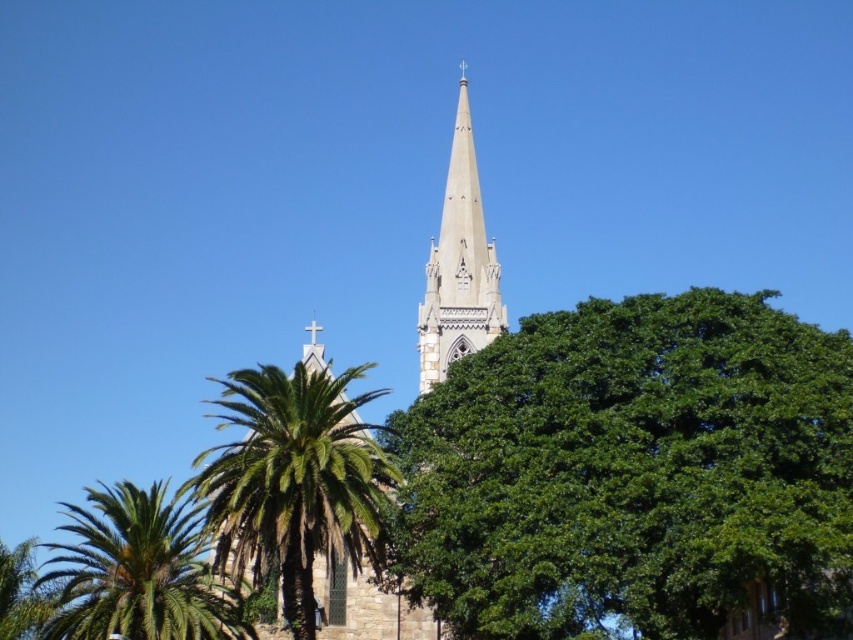
Can you confirm if green leafy tree at center is positioned above white stone church steeple at center?

Actually, green leafy tree at center is below white stone church steeple at center.

Who is more forward, (706,444) or (477,214)?

Positioned in front is point (706,444).

The height and width of the screenshot is (640, 853). What are the coordinates of `green leafy tree at center` in the screenshot? It's located at (631, 472).

Who is shorter, green leafy tree at center or smooth stone spire at center?

green leafy tree at center

Who is taller, green leafy tree at center or smooth stone spire at center?

Standing taller between the two is smooth stone spire at center.

The image size is (853, 640). I want to click on green leafy tree at center, so click(x=631, y=472).

Looking at this image, can you confirm if green leafy tree at center is taller than green leafy palm tree at lower left?

Indeed, green leafy tree at center has a greater height compared to green leafy palm tree at lower left.

In the scene shown: Who is more distant from viewer, (596,314) or (283,454)?

Positioned behind is point (596,314).

Where is `green leafy tree at center`? The image size is (853, 640). green leafy tree at center is located at coordinates (631, 472).